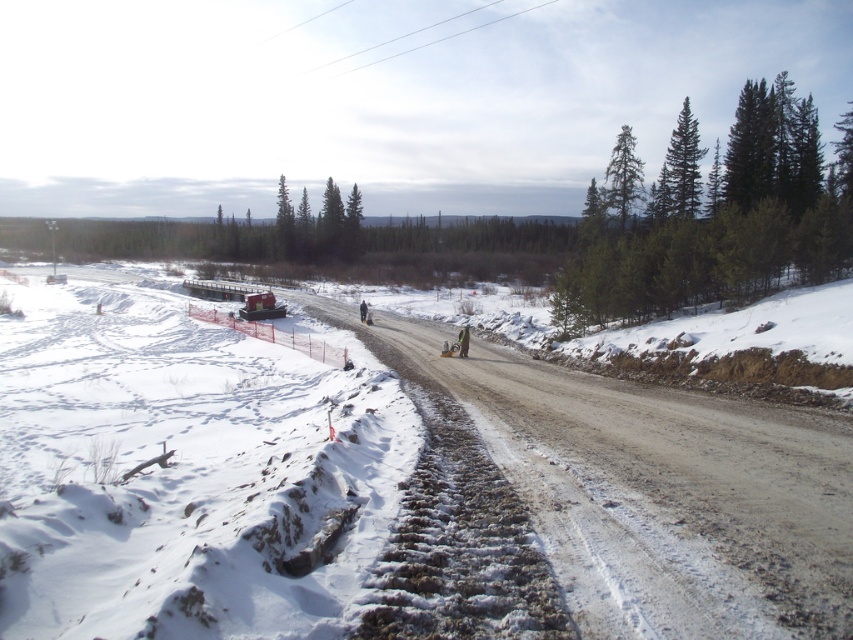
From the picture: Is dusty gravel road at center above dark brown leather jacket at center?

No.

Is dusty gravel road at center shorter than dark brown leather jacket at center?

Indeed, dusty gravel road at center has a lesser height compared to dark brown leather jacket at center.

Between point (581, 545) and point (463, 340), which one is positioned in front?

Point (581, 545)

Locate an element on the screen. This screenshot has height=640, width=853. dusty gravel road at center is located at coordinates (653, 490).